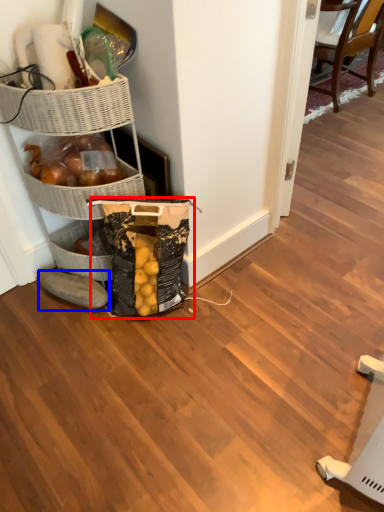
Question: Among these objects, which one is nearest to the camera, grocery bag (highlighted by a red box) or footwear (highlighted by a blue box)?

Choices:
 (A) grocery bag
 (B) footwear

Answer: (A)